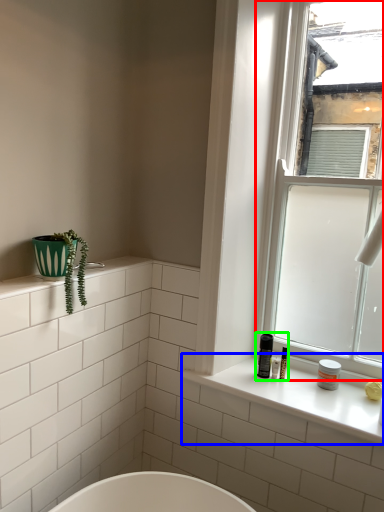
Question: Based on their relative distances, which object is nearer to window (highlighted by a red box)? Choose from window sill (highlighted by a blue box) and toiletry (highlighted by a green box).

Choices:
 (A) window sill
 (B) toiletry

Answer: (A)